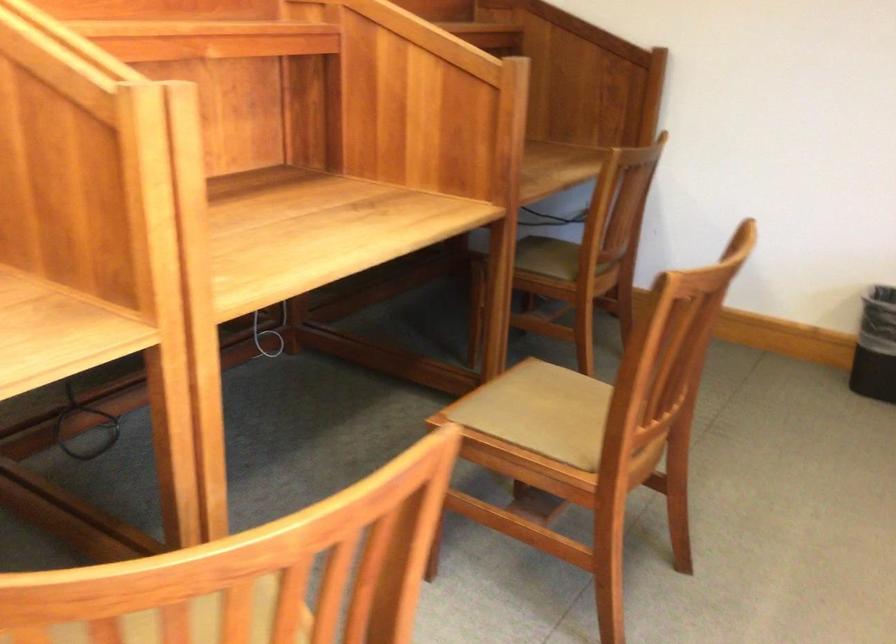
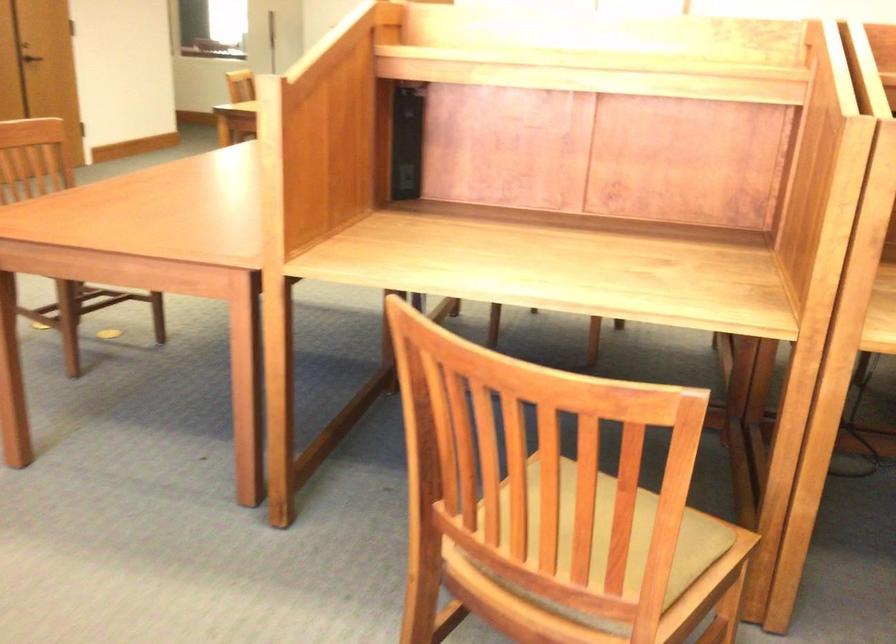
Question: The images are taken continuously from a first-person perspective. In which direction is your viewpoint rotating?

Choices:
 (A) Left
 (B) Right
 (C) Up
 (D) Down

Answer: (A)